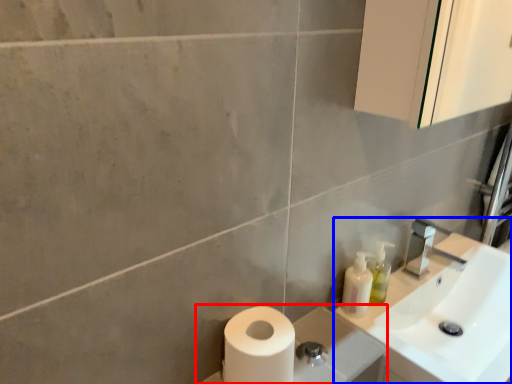
Question: Which point is closer to the camera, porcelain (highlighted by a red box) or sink (highlighted by a blue box)?

Choices:
 (A) porcelain
 (B) sink

Answer: (A)